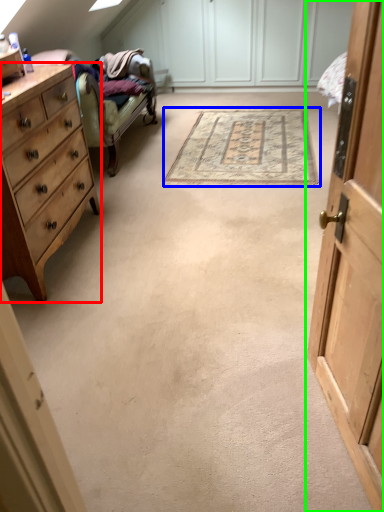
Question: Which is farther away from chest of drawers (highlighted by a red box)? mat (highlighted by a blue box) or cabinetry (highlighted by a green box)?

Choices:
 (A) mat
 (B) cabinetry

Answer: (B)